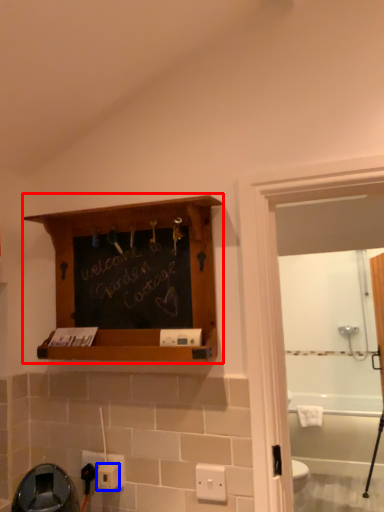
Question: Which of the following is the closest to the observer, shelf (highlighted by a red box) or electric outlet (highlighted by a blue box)?

Choices:
 (A) shelf
 (B) electric outlet

Answer: (A)